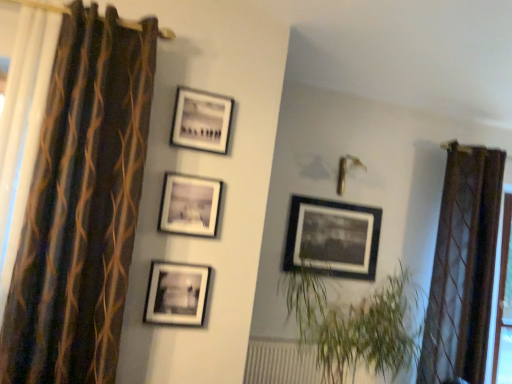
Measure the distance between brown striped curtain at left, the second curtain positioned from the back, and camera.

The depth of brown striped curtain at left, the second curtain positioned from the back, is 1.77 meters.

What is the approximate height of matte black picture frame at center, positioned as the first picture frame in left-to-right order?

It is 35.34 centimeters.

This screenshot has width=512, height=384. I want to click on green leafy plant at center, so click(354, 325).

Consider the image. Measure the distance between point (219,116) and camera.

7.80 feet.

Measure the distance between point (312,211) and camera.

The distance of point (312,211) from camera is 11.46 feet.

Image resolution: width=512 pixels, height=384 pixels. What do you see at coordinates (463, 267) in the screenshot?
I see `brown sheer curtain at right, arranged as the 2th curtain when viewed from the front` at bounding box center [463, 267].

Where is `brown striped curtain at left, which is counted as the second curtain, starting from the right`? brown striped curtain at left, which is counted as the second curtain, starting from the right is located at coordinates (82, 205).

Considering the relative sizes of brown striped curtain at left, positioned as the first curtain in front-to-back order, and brown sheer curtain at right, positioned as the first curtain in right-to-left order, in the image provided, is brown striped curtain at left, positioned as the first curtain in front-to-back order, wider than brown sheer curtain at right, positioned as the first curtain in right-to-left order,?

In fact, brown striped curtain at left, positioned as the first curtain in front-to-back order, might be narrower than brown sheer curtain at right, positioned as the first curtain in right-to-left order.

Does brown striped curtain at left, positioned as the first curtain in front-to-back order, appear on the left side of brown sheer curtain at right, positioned as the first curtain in right-to-left order?

Correct, you'll find brown striped curtain at left, positioned as the first curtain in front-to-back order, to the left of brown sheer curtain at right, positioned as the first curtain in right-to-left order.

Is the position of brown striped curtain at left, positioned as the first curtain in front-to-back order, more distant than that of brown sheer curtain at right, placed as the 1th curtain when sorted from back to front?

No, the depth of brown striped curtain at left, positioned as the first curtain in front-to-back order, is less than that of brown sheer curtain at right, placed as the 1th curtain when sorted from back to front.

Is brown striped curtain at left, which appears as the first curtain when viewed from the left, positioned beyond the bounds of brown sheer curtain at right, positioned as the first curtain in right-to-left order?

brown striped curtain at left, which appears as the first curtain when viewed from the left, lies outside brown sheer curtain at right, positioned as the first curtain in right-to-left order,'s area.

From a real-world perspective, is matte black picture frame at center, acting as the 4th picture frame starting from the left, positioned above or below matte black picture frame at center, which is the second picture frame from front to back?

In terms of real-world spatial position, matte black picture frame at center, acting as the 4th picture frame starting from the left, is below matte black picture frame at center, which is the second picture frame from front to back.

Is the depth of matte black picture frame at center, acting as the 4th picture frame starting from the left, greater than that of matte black picture frame at center, which is the 2th picture frame in left-to-right order?

Yes, it is behind matte black picture frame at center, which is the 2th picture frame in left-to-right order.

Would you say matte black picture frame at center, acting as the 4th picture frame starting from the left, is to the left or to the right of matte black picture frame at center, which is the 2th picture frame in left-to-right order, in the picture?

matte black picture frame at center, acting as the 4th picture frame starting from the left, is positioned on matte black picture frame at center, which is the 2th picture frame in left-to-right order,'s right side.

Would you say matte black picture frame at center, the 1th picture frame when ordered from back to front, is a long distance from matte black picture frame at center, which is the second picture frame from front to back?

Yes.

Considering the positions of point (344, 367) and point (196, 267), is point (344, 367) closer or farther from the camera than point (196, 267)?

Point (344, 367) is farther from the camera than point (196, 267).

From a real-world perspective, which is physically above, green leafy plant at center or matte black picture frame at center, which is the fourth picture frame from back to front?

In real-world perspective, matte black picture frame at center, which is the fourth picture frame from back to front, is above.

Where is `houseplant to the right of matte black picture frame at center, which is the fourth picture frame from back to front`? houseplant to the right of matte black picture frame at center, which is the fourth picture frame from back to front is located at coordinates (354, 325).

Are matte black picture frame at center, which is the 2th picture frame in left-to-right order, and matte black picture frame at upper center, arranged as the second picture frame when viewed from the back, making contact?

No.

I want to click on picture frame that is the 1st one when counting downward from the matte black picture frame at upper center, the 3th picture frame viewed from the left (from the image's perspective), so click(x=189, y=205).

Is matte black picture frame at center, which is the second picture frame from front to back, inside or outside of matte black picture frame at upper center, the 3th picture frame viewed from the left?

The correct answer is: outside.

From the picture: From a real-world perspective, relative to matte black picture frame at upper center, arranged as the second picture frame when viewed from the back, is matte black picture frame at center, the 3th picture frame when ordered from back to front, vertically above or below?

matte black picture frame at center, the 3th picture frame when ordered from back to front, is situated lower than matte black picture frame at upper center, arranged as the second picture frame when viewed from the back, in the real world.

At what (x,y) coordinates should I click in order to perform the action: click on the 4th picture frame positioned above the brown sheer curtain at right, which is the 2th curtain in left-to-right order (from the image's perspective). Please return your answer as a coordinate pair (x, y). This screenshot has width=512, height=384. Looking at the image, I should click on (201, 120).

Looking at the image, does matte black picture frame at upper center, arranged as the second picture frame when viewed from the back, seem bigger or smaller compared to brown sheer curtain at right, positioned as the first curtain in right-to-left order?

Clearly, matte black picture frame at upper center, arranged as the second picture frame when viewed from the back, is smaller in size than brown sheer curtain at right, positioned as the first curtain in right-to-left order.

Is matte black picture frame at upper center, which ranks as the third picture frame in front-to-back order, not near brown sheer curtain at right, positioned as the first curtain in right-to-left order?

matte black picture frame at upper center, which ranks as the third picture frame in front-to-back order, is far away from brown sheer curtain at right, positioned as the first curtain in right-to-left order.

Does matte black picture frame at upper center, which ranks as the 2th picture frame in right-to-left order, have a lesser height compared to brown sheer curtain at right, positioned as the first curtain in right-to-left order?

Yes.

Is green leafy plant at center completely or partially outside of brown striped curtain at left, the second curtain positioned from the back?

green leafy plant at center lies outside brown striped curtain at left, the second curtain positioned from the back,'s area.

Considering the relative sizes of green leafy plant at center and brown striped curtain at left, positioned as the first curtain in front-to-back order, in the image provided, is green leafy plant at center taller than brown striped curtain at left, positioned as the first curtain in front-to-back order,?

No.

Does green leafy plant at center turn towards brown striped curtain at left, positioned as the first curtain in front-to-back order?

No, green leafy plant at center is not aimed at brown striped curtain at left, positioned as the first curtain in front-to-back order.

Looking at this image, relative to brown striped curtain at left, positioned as the first curtain in front-to-back order, is green leafy plant at center in front or behind?

In the image, green leafy plant at center appears behind brown striped curtain at left, positioned as the first curtain in front-to-back order.

From a real-world perspective, which is physically below, matte black picture frame at center, the fourth picture frame from the right, or brown sheer curtain at right, placed as the 1th curtain when sorted from back to front?

matte black picture frame at center, the fourth picture frame from the right, from a real-world perspective.

From the picture: Which of these two, matte black picture frame at center, the fourth picture frame from the right, or brown sheer curtain at right, which is the 2th curtain in left-to-right order, is bigger?

brown sheer curtain at right, which is the 2th curtain in left-to-right order, is bigger.

Are matte black picture frame at center, the fourth picture frame from the right, and brown sheer curtain at right, arranged as the 2th curtain when viewed from the front, located far from each other?

Indeed, matte black picture frame at center, the fourth picture frame from the right, is not near brown sheer curtain at right, arranged as the 2th curtain when viewed from the front.

Which of these two, matte black picture frame at center, acting as the first picture frame starting from the front, or brown sheer curtain at right, which is the 2th curtain in left-to-right order, is thinner?

Thinner between the two is matte black picture frame at center, acting as the first picture frame starting from the front.

Identify the location of curtain below the brown striped curtain at left, positioned as the first curtain in front-to-back order (from the image's perspective). This screenshot has width=512, height=384. (463, 267).

At what (x,y) coordinates should I click in order to perform the action: click on the 2nd picture frame behind the matte black picture frame at center, which is the second picture frame from front to back, starting your count from the anchor. Please return your answer as a coordinate pair (x, y). The image size is (512, 384). Looking at the image, I should click on (333, 238).

Considering their positions, is brown sheer curtain at right, which is the 2th curtain in left-to-right order, positioned further to matte black picture frame at upper center, which ranks as the third picture frame in front-to-back order, than matte black picture frame at center, the first picture frame from the right?

Based on the image, brown sheer curtain at right, which is the 2th curtain in left-to-right order, appears to be further to matte black picture frame at upper center, which ranks as the third picture frame in front-to-back order.

When comparing their distances from brown sheer curtain at right, positioned as the first curtain in right-to-left order, does matte black picture frame at center, acting as the fourth picture frame starting from the front, or matte black picture frame at upper center, which ranks as the 2th picture frame in right-to-left order, seem further?

The object further to brown sheer curtain at right, positioned as the first curtain in right-to-left order, is matte black picture frame at upper center, which ranks as the 2th picture frame in right-to-left order.

Based on their spatial positions, is matte black picture frame at upper center, arranged as the second picture frame when viewed from the back, or brown sheer curtain at right, positioned as the first curtain in right-to-left order, further from matte black picture frame at center, which is counted as the 3th picture frame, starting from the right?

brown sheer curtain at right, positioned as the first curtain in right-to-left order.

Based on their spatial positions, is brown striped curtain at left, which appears as the first curtain when viewed from the left, or brown sheer curtain at right, positioned as the first curtain in right-to-left order, closer to matte black picture frame at center, which is counted as the 3th picture frame, starting from the right?

brown striped curtain at left, which appears as the first curtain when viewed from the left, lies closer to matte black picture frame at center, which is counted as the 3th picture frame, starting from the right, than the other object.

From the image, which object appears to be nearer to matte black picture frame at center, which is the fourth picture frame from back to front, brown sheer curtain at right, which is the 2th curtain in left-to-right order, or matte black picture frame at upper center, which ranks as the third picture frame in front-to-back order?

matte black picture frame at upper center, which ranks as the third picture frame in front-to-back order.

From the image, which object appears to be nearer to green leafy plant at center, matte black picture frame at upper center, which ranks as the third picture frame in front-to-back order, or matte black picture frame at center, acting as the fourth picture frame starting from the front?

matte black picture frame at center, acting as the fourth picture frame starting from the front, is positioned closer to the anchor green leafy plant at center.

Estimate the real-world distances between objects in this image. Which object is closer to matte black picture frame at center, acting as the fourth picture frame starting from the front, matte black picture frame at center, which is the fourth picture frame from back to front, or matte black picture frame at upper center, arranged as the second picture frame when viewed from the back?

matte black picture frame at center, which is the fourth picture frame from back to front, is closer to matte black picture frame at center, acting as the fourth picture frame starting from the front.

Looking at the image, which one is located closer to matte black picture frame at center, which is the second picture frame from front to back, brown sheer curtain at right, arranged as the 2th curtain when viewed from the front, or matte black picture frame at center, acting as the fourth picture frame starting from the front?

matte black picture frame at center, acting as the fourth picture frame starting from the front, is closer to matte black picture frame at center, which is the second picture frame from front to back.

At what (x,y) coordinates should I click in order to perform the action: click on picture frame positioned between matte black picture frame at center, the 3th picture frame when ordered from back to front, and matte black picture frame at center, acting as the 4th picture frame starting from the left, from near to far. Please return your answer as a coordinate pair (x, y). The height and width of the screenshot is (384, 512). Looking at the image, I should click on (201, 120).

At what (x,y) coordinates should I click in order to perform the action: click on houseplant between matte black picture frame at center, positioned as the first picture frame in left-to-right order, and brown sheer curtain at right, placed as the 1th curtain when sorted from back to front, in the horizontal direction. Please return your answer as a coordinate pair (x, y). The image size is (512, 384). Looking at the image, I should click on (354, 325).

Image resolution: width=512 pixels, height=384 pixels. I want to click on picture frame between matte black picture frame at upper center, arranged as the second picture frame when viewed from the back, and brown sheer curtain at right, positioned as the first curtain in right-to-left order, so click(x=333, y=238).

Identify the location of houseplant between brown striped curtain at left, which appears as the first curtain when viewed from the left, and brown sheer curtain at right, placed as the 1th curtain when sorted from back to front, in the horizontal direction. This screenshot has height=384, width=512. click(354, 325).